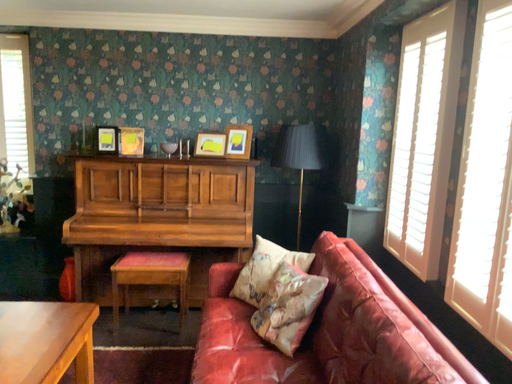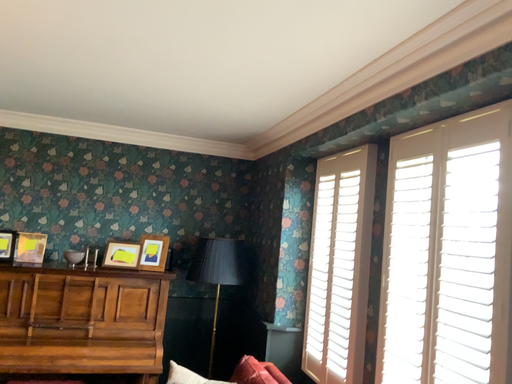
Question: How did the camera likely rotate when shooting the video?

Choices:
 (A) rotated left
 (B) rotated right

Answer: (B)